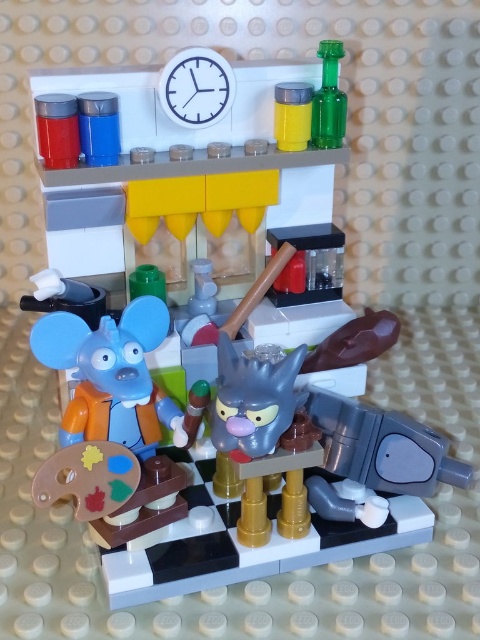
Question: Does white plastic clock at upper center have a smaller size compared to green glass bottle at upper right?

Choices:
 (A) yes
 (B) no

Answer: (B)

Question: From the image, what is the correct spatial relationship of white plastic clock at upper center in relation to green glass bottle at upper right?

Choices:
 (A) below
 (B) above

Answer: (A)

Question: Among these objects, which one is farthest from the camera?

Choices:
 (A) green glass bottle at upper right
 (B) white plastic clock at upper center

Answer: (A)

Question: Is white plastic clock at upper center thinner than green glass bottle at upper right?

Choices:
 (A) no
 (B) yes

Answer: (A)

Question: Which object appears closest to the camera in this image?

Choices:
 (A) green glass bottle at upper right
 (B) white plastic clock at upper center

Answer: (B)